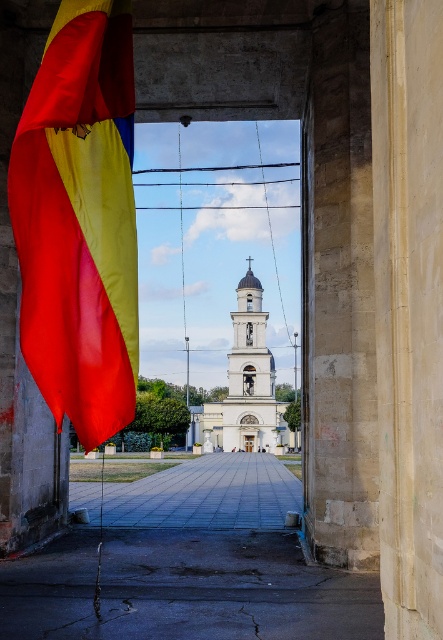
Question: Where is matte fabric flag at left located in relation to white stone church at center in the image?

Choices:
 (A) above
 (B) below

Answer: (A)

Question: Among these objects, which one is farthest from the camera?

Choices:
 (A) paved stone alley at center
 (B) matte fabric flag at left

Answer: (A)

Question: Estimate the real-world distances between objects in this image. Which object is farther from the white stone church at center?

Choices:
 (A) paved stone alley at center
 (B) matte fabric flag at left

Answer: (B)

Question: Can you confirm if matte fabric flag at left is positioned to the left of white stone church at center?

Choices:
 (A) no
 (B) yes

Answer: (B)

Question: Does paved stone alley at center lie behind white stone church at center?

Choices:
 (A) yes
 (B) no

Answer: (B)

Question: Which object is closer to the camera taking this photo?

Choices:
 (A) matte fabric flag at left
 (B) white stone church at center

Answer: (A)